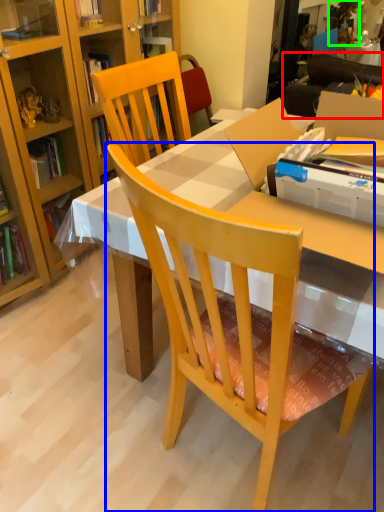
Question: Which object is positioned farthest from studio couch (highlighted by a red box)? Select from chair (highlighted by a blue box) and houseplant (highlighted by a green box).

Choices:
 (A) chair
 (B) houseplant

Answer: (A)